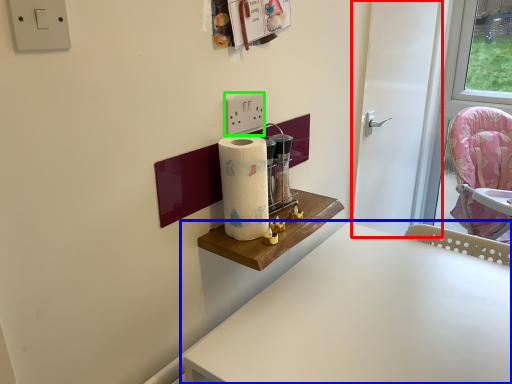
Question: Considering the real-world distances, which object is farthest from door (highlighted by a red box)? table (highlighted by a blue box) or light switch (highlighted by a green box)?

Choices:
 (A) table
 (B) light switch

Answer: (B)